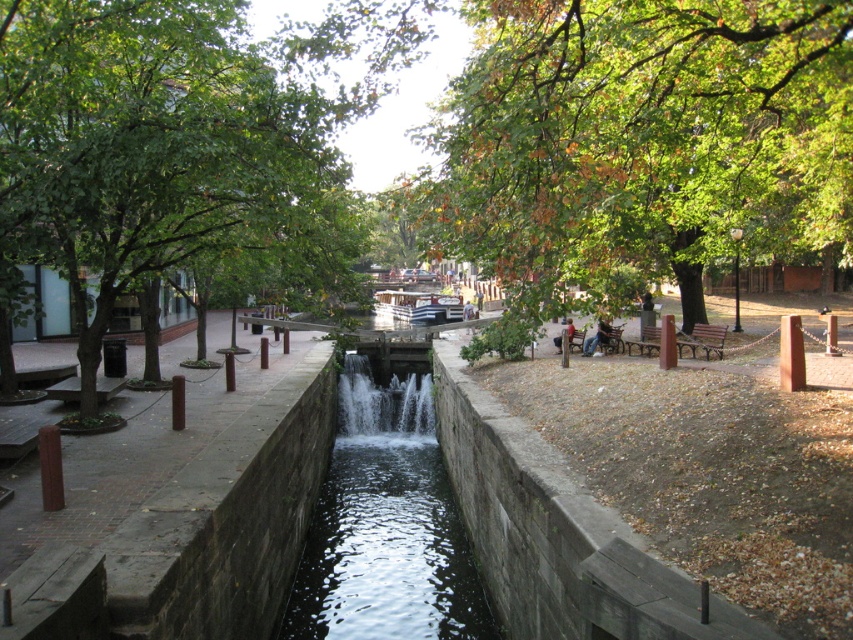
You are standing at the edge of the canal in the urban park scene. You notice a green leafy tree at upper center and dark blue jeans at center. Which object is positioned to the right of the other?

The green leafy tree at upper center is to the right of the dark blue jeans at center.

You are standing at the edge of the canal in the park, and you see the clear water at center and the leather jacket at center. You want to throw a small pebble into the water. Which object is closer to you so you can accurately aim your throw?

The clear water at center is 19.53 feet away from the leather jacket at center. Since both objects are at the center, they are equidistant from your position at the edge, so you can aim either one as they are the same distance away.